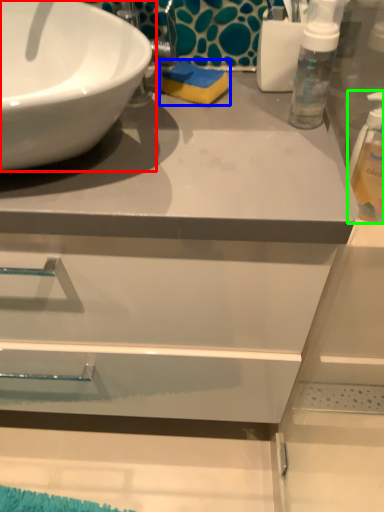
Question: Based on their relative distances, which object is farther from sink (highlighted by a red box)? Choose from soap (highlighted by a blue box) and cleaning product (highlighted by a green box).

Choices:
 (A) soap
 (B) cleaning product

Answer: (B)